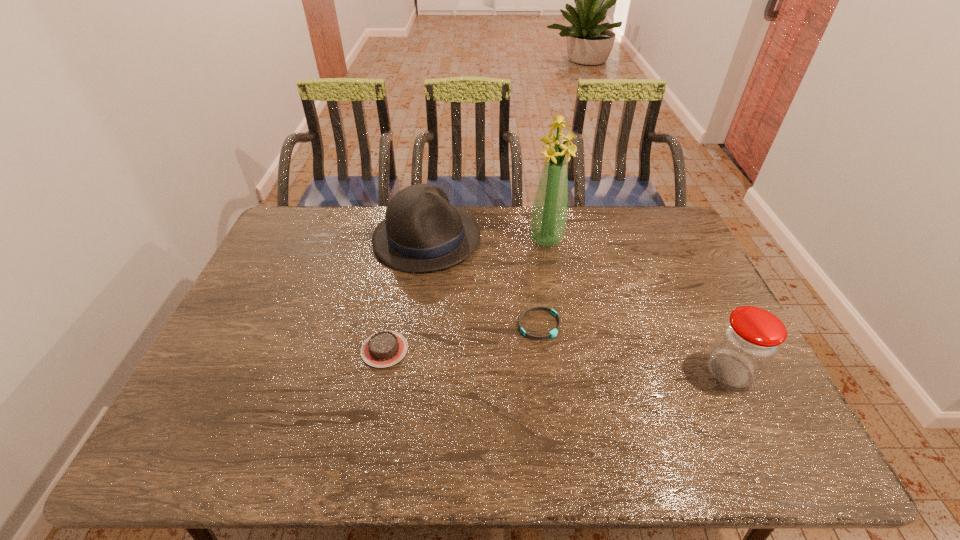
The width and height of the screenshot is (960, 540). What are the coordinates of `vacant space in between the bouquet and the jar` in the screenshot? It's located at (637, 305).

Locate an element on the screen. The width and height of the screenshot is (960, 540). free spot between the second shortest object and the jar is located at coordinates (557, 360).

This screenshot has width=960, height=540. I want to click on blank region between the rightmost object and the tallest object, so click(637, 305).

Image resolution: width=960 pixels, height=540 pixels. I want to click on free area in between the second shortest object and the bowler hat, so click(x=406, y=294).

At what (x,y) coordinates should I click in order to perform the action: click on vacant area between the jar and the chocolate cake. Please return your answer as a coordinate pair (x, y). Looking at the image, I should click on (557, 360).

At what (x,y) coordinates should I click in order to perform the action: click on vacant space that's between the wristband and the tallest object. Please return your answer as a coordinate pair (x, y). This screenshot has width=960, height=540. Looking at the image, I should click on (542, 282).

This screenshot has height=540, width=960. Identify the location of free spot between the jar and the shortest object. (635, 348).

Locate an element on the screen. The height and width of the screenshot is (540, 960). vacant area between the bouquet and the second shortest object is located at coordinates (466, 294).

The height and width of the screenshot is (540, 960). What are the coordinates of `free space that is in between the chocolate cake and the shortest object` in the screenshot? It's located at (462, 337).

Point out which object is positioned as the second nearest to the fourth tallest object. Please provide its 2D coordinates. Your answer should be formatted as a tuple, i.e. [(x, y)], where the tuple contains the x and y coordinates of a point satisfying the conditions above.

[(554, 332)]